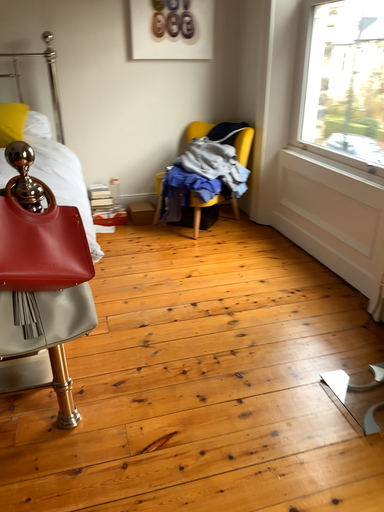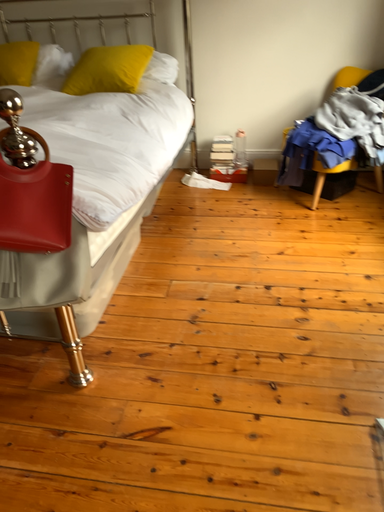
Question: Which way did the camera rotate in the video?

Choices:
 (A) rotated right
 (B) rotated left

Answer: (B)